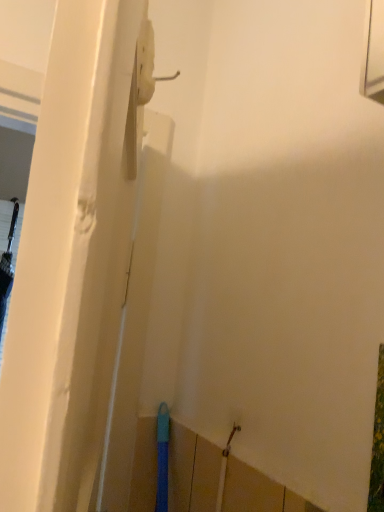
Describe the element at coordinates (70, 262) in the screenshot. The height and width of the screenshot is (512, 384). I see `white matte door at left` at that location.

What is the approximate height of white matte door at left?

It is 31.34 inches.

Locate an element on the screen. The height and width of the screenshot is (512, 384). white matte door at left is located at coordinates (70, 262).

At what (x,y) coordinates should I click in order to perform the action: click on white matte door at left. Please return your answer as a coordinate pair (x, y). The height and width of the screenshot is (512, 384). Looking at the image, I should click on (70, 262).